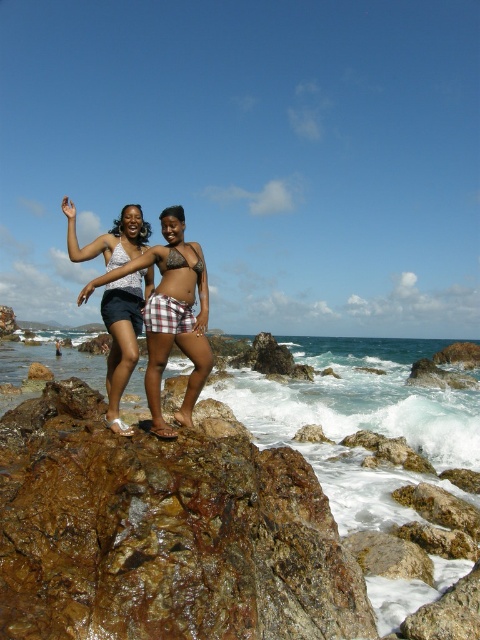
Who is positioned more to the left, matte white tank top at center or matte skin bikini at center?

matte skin bikini at center

Who is lower down, matte white tank top at center or matte skin bikini at center?

matte white tank top at center is below.

What do you see at coordinates (122, 337) in the screenshot? Image resolution: width=480 pixels, height=640 pixels. I see `matte white tank top at center` at bounding box center [122, 337].

In order to click on matte white tank top at center in this screenshot , I will do `click(122, 337)`.

Can you confirm if white lace bikini top at center is positioned to the right of white matte bikini top at center?

In fact, white lace bikini top at center is to the left of white matte bikini top at center.

How far apart are white lace bikini top at center and white matte bikini top at center?

They are 1.20 meters apart.

Is point (115, 268) in front of point (179, 253)?

That is False.

Image resolution: width=480 pixels, height=640 pixels. I want to click on white lace bikini top at center, so click(x=130, y=284).

Does brown rough rock at center appear under white matte bikini top at center?

Yes, brown rough rock at center is below white matte bikini top at center.

Which is more to the left, brown rough rock at center or white matte bikini top at center?

Positioned to the left is brown rough rock at center.

Who is more forward, (135, 515) or (173, 248)?

Positioned in front is point (135, 515).

Locate an element on the screen. brown rough rock at center is located at coordinates [163, 532].